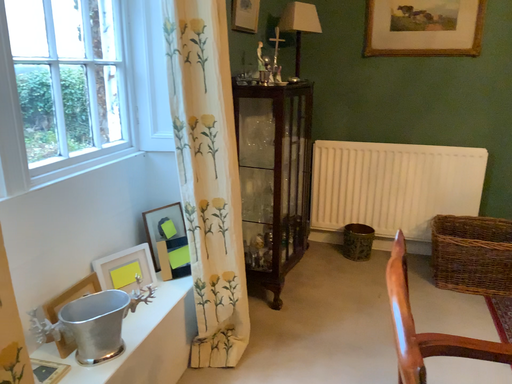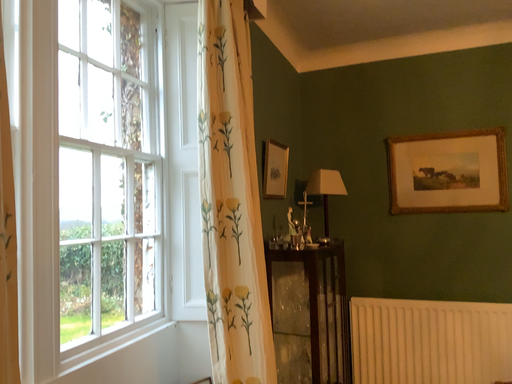
Question: Which way did the camera rotate in the video?

Choices:
 (A) rotated downward
 (B) rotated upward

Answer: (B)